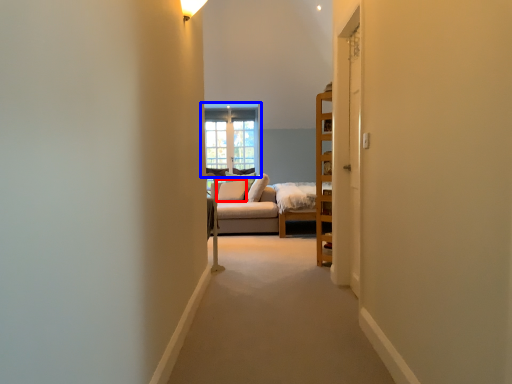
Question: Which object is further to the camera taking this photo, pillow (highlighted by a red box) or window (highlighted by a blue box)?

Choices:
 (A) pillow
 (B) window

Answer: (B)